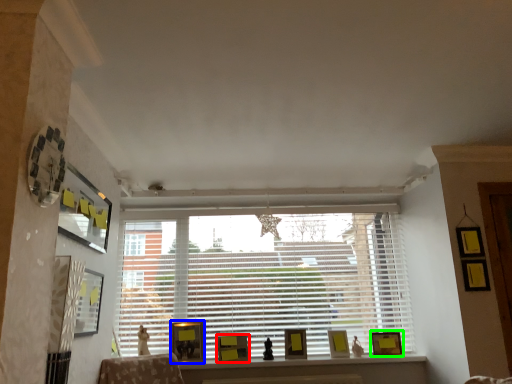
Question: Estimate the real-world distances between objects in this image. Which object is farther from picture frame (highlighted by a red box), picture frame (highlighted by a blue box) or picture frame (highlighted by a green box)?

Choices:
 (A) picture frame
 (B) picture frame

Answer: (B)